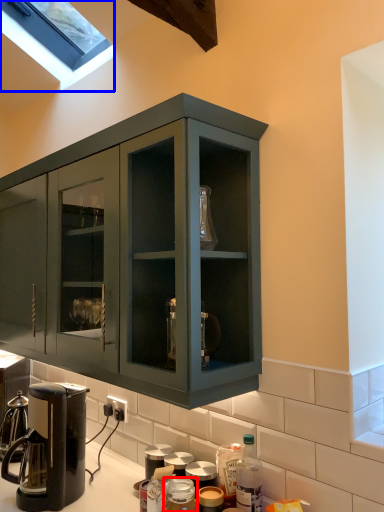
Question: Which of the following is the farthest to the observer, bottle (highlighted by a red box) or window (highlighted by a blue box)?

Choices:
 (A) bottle
 (B) window

Answer: (B)